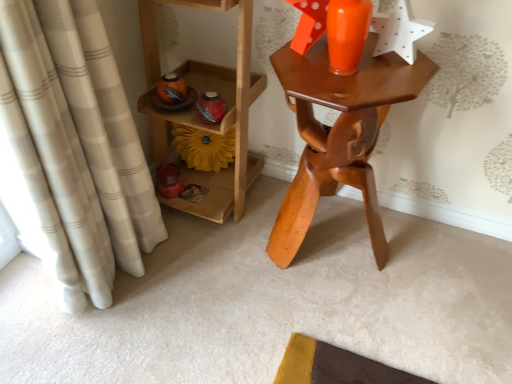
In order to face wooden shelf at left, should I rotate leftwards or rightwards?

Rotate left and turn 8.109 degrees.

What is the approximate height of wooden shelf at left?

wooden shelf at left is 31.83 inches tall.

At what (x,y) coordinates should I click in order to perform the action: click on beige plaid curtain at left. Please return your answer as a coordinate pair (x, y). Looking at the image, I should click on (75, 145).

Is point (7, 23) farther from viewer compared to point (284, 252)?

That is False.

How much distance is there between beige plaid curtain at left and wooden table at center?

21.30 inches.

From the image's perspective, is beige plaid curtain at left above or below wooden table at center?

Based on their image positions, beige plaid curtain at left is located beneath wooden table at center.

Which of these two, beige plaid curtain at left or wooden table at center, is thinner?

With smaller width is beige plaid curtain at left.

Who is taller, wooden shelf at left or wooden table at center?

Standing taller between the two is wooden shelf at left.

Is wooden table at center at the back of wooden shelf at left?

wooden shelf at left is not turned away from wooden table at center.

What's the angular difference between wooden shelf at left and wooden table at center's facing directions?

The angular difference between wooden shelf at left and wooden table at center is 1.14 degrees.

From the image's perspective, is beige plaid curtain at left positioned above or below yellow fabric flower at center?

beige plaid curtain at left is situated lower than yellow fabric flower at center in the image.

Looking at their sizes, would you say beige plaid curtain at left is wider or thinner than yellow fabric flower at center?

Clearly, beige plaid curtain at left has more width compared to yellow fabric flower at center.

Locate an element on the screen. curtain above the yellow fabric flower at center (from a real-world perspective) is located at coordinates (75, 145).

Is beige plaid curtain at left beside yellow fabric flower at center?

There is a gap between beige plaid curtain at left and yellow fabric flower at center.

Between yellow fabric flower at center and wooden shelf at left, which one has less height?

yellow fabric flower at center.

This screenshot has width=512, height=384. Find the location of `furniture on the left of yellow fabric flower at center`. furniture on the left of yellow fabric flower at center is located at coordinates [202, 122].

From a real-world perspective, is yellow fabric flower at center above or below wooden shelf at left?

yellow fabric flower at center is below wooden shelf at left.

Considering the relative positions of yellow fabric flower at center and wooden shelf at left in the image provided, is yellow fabric flower at center to the left or to the right of wooden shelf at left?

Based on their positions, yellow fabric flower at center is located to the right of wooden shelf at left.

Is yellow fabric flower at center oriented away from wooden table at center?

yellow fabric flower at center is not turned away from wooden table at center.

Identify the location of flower located above the wooden table at center (from the image's perspective). (204, 147).

Is yellow fabric flower at center not near wooden table at center?

yellow fabric flower at center is near wooden table at center, not far away.

Based on the photo, between yellow fabric flower at center and wooden table at center, which one appears on the left side from the viewer's perspective?

Positioned to the left is yellow fabric flower at center.

Considering the relative sizes of yellow fabric flower at center and beige plaid curtain at left in the image provided, is yellow fabric flower at center bigger than beige plaid curtain at left?

No, yellow fabric flower at center is not bigger than beige plaid curtain at left.

Find the location of a particular element. curtain positioned vertically above the yellow fabric flower at center (from a real-world perspective) is located at coordinates click(x=75, y=145).

From a real-world perspective, is yellow fabric flower at center over beige plaid curtain at left?

No, from a real-world perspective, yellow fabric flower at center is not above beige plaid curtain at left.

How many degrees apart are the facing directions of yellow fabric flower at center and beige plaid curtain at left?

yellow fabric flower at center and beige plaid curtain at left are facing 78.4 degrees away from each other.

Is wooden table at center in contact with yellow fabric flower at center?

They are not placed beside each other.

From a real-world perspective, between wooden table at center and yellow fabric flower at center, who is vertically higher?

wooden table at center, from a real-world perspective.

Is wooden table at center aimed at yellow fabric flower at center?

No, wooden table at center is not facing towards yellow fabric flower at center.

Between wooden table at center and yellow fabric flower at center, which one has less height?

Standing shorter between the two is yellow fabric flower at center.

This screenshot has height=384, width=512. In order to click on table on the right of beige plaid curtain at left in this screenshot , I will do `click(338, 135)`.

This screenshot has height=384, width=512. What are the coordinates of `furniture on the left side of wooden table at center` in the screenshot? It's located at (202, 122).

When comparing their distances from beige plaid curtain at left, does wooden shelf at left or yellow fabric flower at center seem closer?

wooden shelf at left lies closer to beige plaid curtain at left than the other object.

Based on their spatial positions, is wooden table at center or wooden shelf at left further from yellow fabric flower at center?

wooden table at center lies further to yellow fabric flower at center than the other object.

Considering their positions, is yellow fabric flower at center positioned further to wooden shelf at left than beige plaid curtain at left?

beige plaid curtain at left is positioned further to the anchor wooden shelf at left.

Considering their positions, is wooden shelf at left positioned closer to yellow fabric flower at center than wooden table at center?

Among the two, wooden shelf at left is located nearer to yellow fabric flower at center.

Which object lies further to the anchor point beige plaid curtain at left, wooden table at center or yellow fabric flower at center?

yellow fabric flower at center.

From the image, which object appears to be farther from wooden table at center, beige plaid curtain at left or wooden shelf at left?

beige plaid curtain at left is further to wooden table at center.

In the scene shown: Estimate the real-world distances between objects in this image. Which object is closer to wooden table at center, beige plaid curtain at left or yellow fabric flower at center?

yellow fabric flower at center lies closer to wooden table at center than the other object.

From the image, which object appears to be farther from wooden shelf at left, beige plaid curtain at left or wooden table at center?

Based on the image, beige plaid curtain at left appears to be further to wooden shelf at left.

Where is `furniture between beige plaid curtain at left and yellow fabric flower at center along the z-axis`? This screenshot has height=384, width=512. furniture between beige plaid curtain at left and yellow fabric flower at center along the z-axis is located at coordinates (202, 122).

You are a GUI agent. You are given a task and a screenshot of the screen. Output one action in this format:
    pyautogui.click(x=<x>, y=<y>)
    Task: Click on the table between beige plaid curtain at left and yellow fabric flower at center from front to back
    This screenshot has height=384, width=512.
    Given the screenshot: What is the action you would take?
    pyautogui.click(x=338, y=135)

Image resolution: width=512 pixels, height=384 pixels. Find the location of `furniture between wooden table at center and yellow fabric flower at center in the front-back direction`. furniture between wooden table at center and yellow fabric flower at center in the front-back direction is located at coordinates (202, 122).

Image resolution: width=512 pixels, height=384 pixels. What are the coordinates of `furniture located between beige plaid curtain at left and wooden table at center in the left-right direction` in the screenshot? It's located at (202, 122).